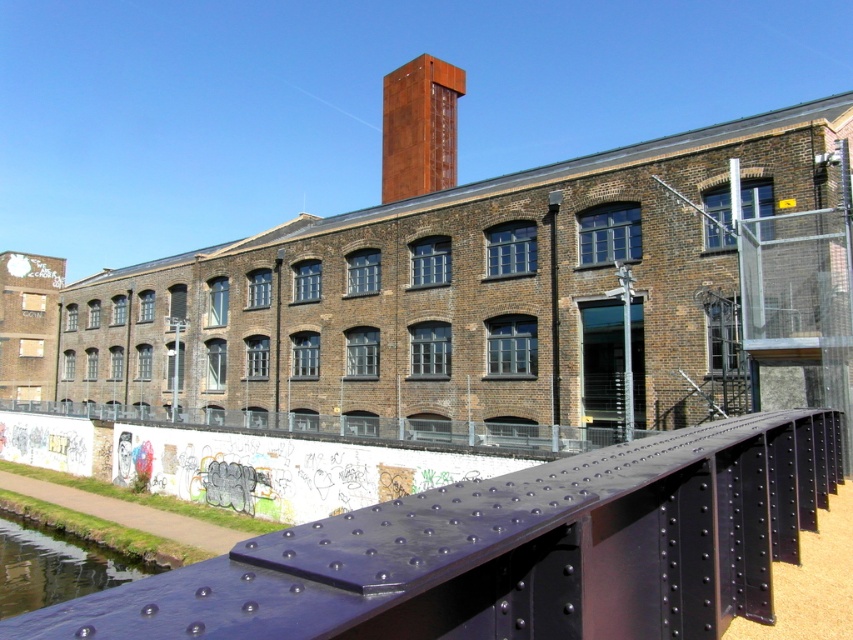
You are a maintenance worker tasked with replacing a damaged rail. You have a steel rail that is exactly the same width as the clear glass water at lower left. Will this new rail fit in the space where the smooth steel rail at lower center is currently located?

The smooth steel rail at lower center is wider than the clear glass water at lower left. Since the new rail matches the width of the glass water, it would be narrower than the existing space. Therefore, the new rail can fit in the location of the smooth steel rail at lower center with some extra space remaining.

From the picture: You are standing in front of the building and want to take a photo. There are two points marked on the bridge surface. The first point is at coordinate point (x=303, y=625) and the second is at point (x=94, y=552). Which point will appear closer to the center of your camera view?

Point (x=303, y=625) is closer to the camera than point (x=94, y=552), so it will appear closer to the center of your camera view.